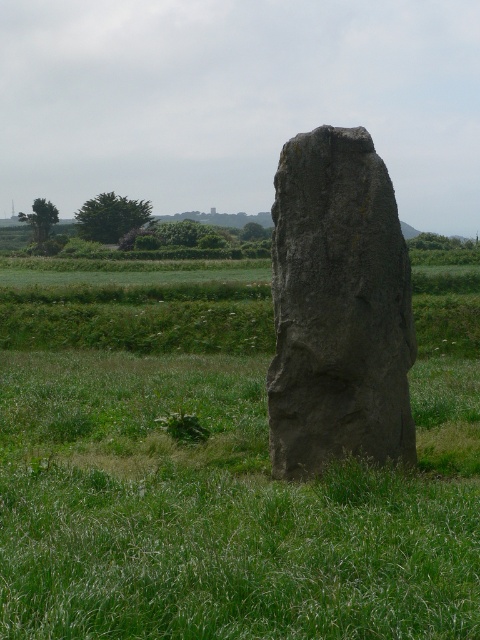
Question: Which object appears farthest from the camera in this image?

Choices:
 (A) gray stone monolith at center
 (B) gray rough stone at center

Answer: (B)

Question: Which point is farther to the camera?

Choices:
 (A) gray rough stone at center
 (B) gray stone monolith at center

Answer: (A)

Question: Is gray stone monolith at center above gray rough stone at center?

Choices:
 (A) yes
 (B) no

Answer: (A)

Question: Among these points, which one is farthest from the camera?

Choices:
 (A) (383, 275)
 (B) (109, 417)

Answer: (B)

Question: Is gray stone monolith at center to the right of gray rough stone at center from the viewer's perspective?

Choices:
 (A) yes
 (B) no

Answer: (B)

Question: Is the position of gray stone monolith at center less distant than that of gray rough stone at center?

Choices:
 (A) no
 (B) yes

Answer: (B)